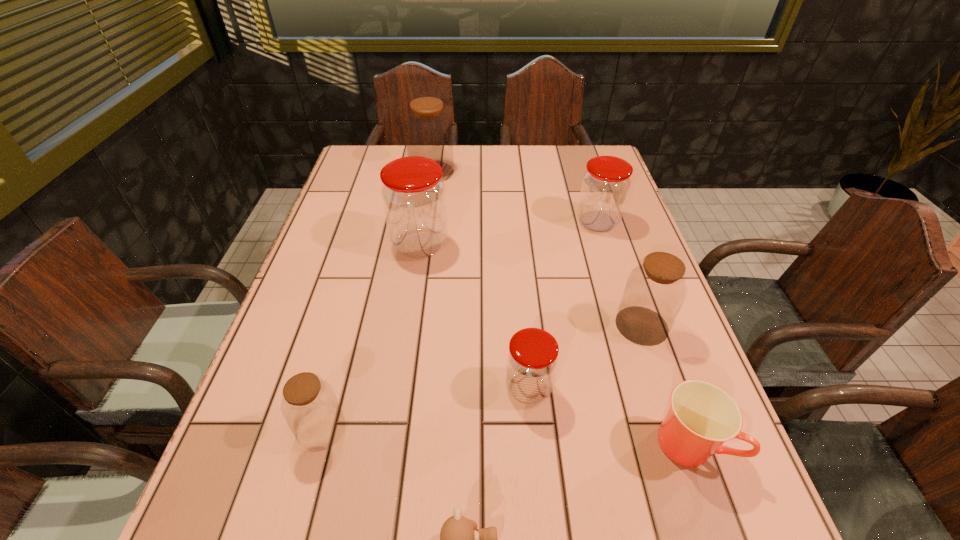
Identify the location of free spot between the fifth object from left to right and the farthest object. The image size is (960, 540). (480, 280).

I want to click on vacant area that lies between the second red jar from right to left and the second biggest red jar, so click(563, 306).

Where is `free spot between the cup and the second brown jar from right to left`? This screenshot has width=960, height=540. free spot between the cup and the second brown jar from right to left is located at coordinates (562, 308).

You are a GUI agent. You are given a task and a screenshot of the screen. Output one action in this format:
    pyautogui.click(x=<x>, y=<y>)
    Task: Click on the unoccupied position between the smallest brown jar and the second biggest brown jar
    
    Given the screenshot: What is the action you would take?
    pyautogui.click(x=482, y=377)

Locate an element on the screen. The width and height of the screenshot is (960, 540). vacant space that's between the third jar from right to left and the cup is located at coordinates (610, 416).

Select which object is the closest to the fifth object from left to right. Please provide its 2D coordinates. Your answer should be formatted as a tuple, i.e. [(x, y)], where the tuple contains the x and y coordinates of a point satisfying the conditions above.

[(702, 416)]

Locate which object is the closest to the fourth farthest object. Please provide its 2D coordinates. Your answer should be formatted as a tuple, i.e. [(x, y)], where the tuple contains the x and y coordinates of a point satisfying the conditions above.

[(702, 416)]

The width and height of the screenshot is (960, 540). In order to click on jar that is the third closest one to the second biggest brown jar in this screenshot , I will do `click(413, 194)`.

Identify the location of jar that stands as the fourth closest to the fifth nearest object. The width and height of the screenshot is (960, 540). (309, 405).

Select which brown jar appears as the third closest to the biggest red jar. Please provide its 2D coordinates. Your answer should be formatted as a tuple, i.e. [(x, y)], where the tuple contains the x and y coordinates of a point satisfying the conditions above.

[(655, 290)]